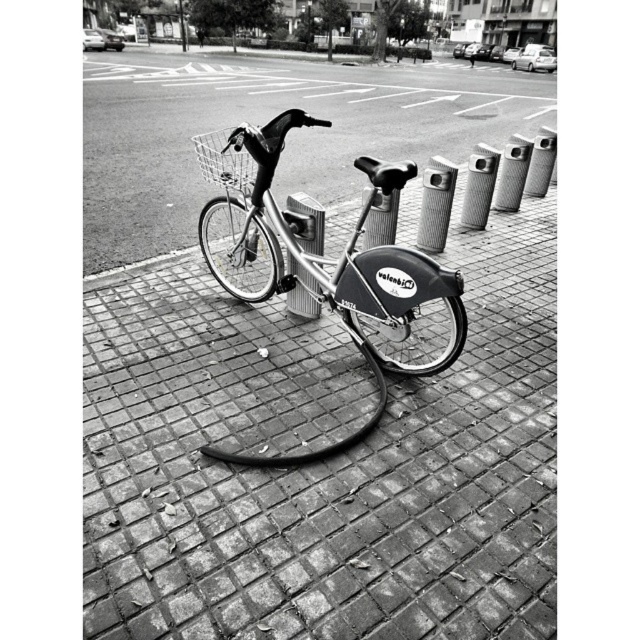
Find the location of a particular element. brick pavement at center is located at coordinates (323, 464).

Does brick pavement at center appear on the left side of metallic wire basket at center?

No, brick pavement at center is not to the left of metallic wire basket at center.

The image size is (640, 640). In order to click on brick pavement at center in this screenshot , I will do `click(323, 464)`.

Is metallic silver bicycle at center in front of metallic wire basket at center?

Yes, metallic silver bicycle at center is closer to the viewer.

Is metallic silver bicycle at center shorter than metallic wire basket at center?

Incorrect, metallic silver bicycle at center's height does not fall short of metallic wire basket at center's.

Locate an element on the screen. metallic silver bicycle at center is located at coordinates (336, 273).

Can you confirm if brick pavement at center is positioned above metallic silver bicycle at center?

Incorrect, brick pavement at center is not positioned above metallic silver bicycle at center.

Who is lower down, brick pavement at center or metallic silver bicycle at center?

brick pavement at center

Between point (116, 554) and point (284, 216), which one is positioned in front?

Positioned in front is point (116, 554).

The height and width of the screenshot is (640, 640). Identify the location of brick pavement at center. (323, 464).